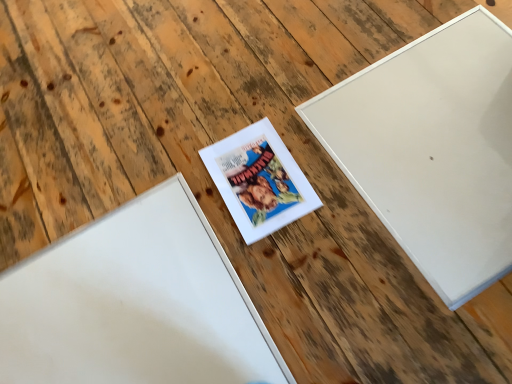
Question: Does white matte picture frame at upper right, which appears as the third picture frame when viewed from the left, turn towards white matte picture frame at center, positioned as the first picture frame in left-to-right order?

Choices:
 (A) no
 (B) yes

Answer: (A)

Question: From the image's perspective, is white matte picture frame at upper right, which appears as the third picture frame when viewed from the left, below white matte picture frame at center, positioned as the first picture frame in left-to-right order?

Choices:
 (A) no
 (B) yes

Answer: (A)

Question: Is the surface of white matte picture frame at upper right, arranged as the first picture frame when viewed from the right, in direct contact with white matte picture frame at center, the 3th picture frame in the right-to-left sequence?

Choices:
 (A) no
 (B) yes

Answer: (A)

Question: Is white matte picture frame at upper right, which appears as the third picture frame when viewed from the left, further to camera compared to white matte picture frame at center, positioned as the first picture frame in left-to-right order?

Choices:
 (A) no
 (B) yes

Answer: (B)

Question: From a real-world perspective, is white matte picture frame at upper right, arranged as the first picture frame when viewed from the right, under white matte picture frame at center, positioned as the first picture frame in left-to-right order?

Choices:
 (A) yes
 (B) no

Answer: (B)

Question: Relative to white matte picture frame at upper right, arranged as the first picture frame when viewed from the right, is white matte picture frame at center, positioned as the 2th picture frame in right-to-left order, in front or behind?

Choices:
 (A) behind
 (B) front

Answer: (A)

Question: Is point (268, 150) positioned closer to the camera than point (454, 183)?

Choices:
 (A) farther
 (B) closer

Answer: (A)

Question: In terms of width, does white matte picture frame at center, positioned as the 2th picture frame in right-to-left order, look wider or thinner when compared to white matte picture frame at upper right, which appears as the third picture frame when viewed from the left?

Choices:
 (A) thin
 (B) wide

Answer: (A)

Question: Considering the positions of white matte picture frame at center, which is the second picture frame from left to right, and white matte picture frame at upper right, arranged as the first picture frame when viewed from the right, in the image, is white matte picture frame at center, which is the second picture frame from left to right, taller or shorter than white matte picture frame at upper right, arranged as the first picture frame when viewed from the right,?

Choices:
 (A) tall
 (B) short

Answer: (A)

Question: Is white matte picture frame at upper right, which appears as the third picture frame when viewed from the left, wider or thinner than white matte picture frame at center, positioned as the first picture frame in left-to-right order?

Choices:
 (A) thin
 (B) wide

Answer: (B)

Question: In terms of height, does white matte picture frame at upper right, arranged as the first picture frame when viewed from the right, look taller or shorter compared to white matte picture frame at center, the 3th picture frame in the right-to-left sequence?

Choices:
 (A) short
 (B) tall

Answer: (A)

Question: Is white matte picture frame at upper right, arranged as the first picture frame when viewed from the right, to the left or to the right of white matte picture frame at center, positioned as the first picture frame in left-to-right order, in the image?

Choices:
 (A) left
 (B) right

Answer: (B)

Question: Considering the positions of white matte picture frame at upper right, arranged as the first picture frame when viewed from the right, and white matte picture frame at center, the 3th picture frame in the right-to-left sequence, in the image, is white matte picture frame at upper right, arranged as the first picture frame when viewed from the right, bigger or smaller than white matte picture frame at center, the 3th picture frame in the right-to-left sequence,?

Choices:
 (A) small
 (B) big

Answer: (B)

Question: From the image's perspective, is white matte picture frame at upper right, arranged as the first picture frame when viewed from the right, above or below white matte picture frame at center, positioned as the 2th picture frame in right-to-left order?

Choices:
 (A) above
 (B) below

Answer: (A)

Question: Considering the relative positions of white matte picture frame at upper right, which appears as the third picture frame when viewed from the left, and white matte picture frame at center, positioned as the 2th picture frame in right-to-left order, in the image provided, is white matte picture frame at upper right, which appears as the third picture frame when viewed from the left, to the left or to the right of white matte picture frame at center, positioned as the 2th picture frame in right-to-left order,?

Choices:
 (A) right
 (B) left

Answer: (A)